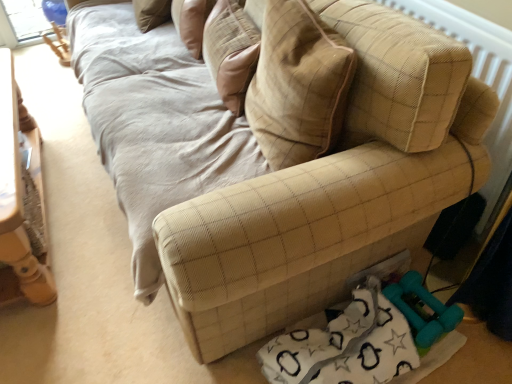
Question: From the image's perspective, relative to teal rubber dumbbells at lower right, is beige textured pillow at upper center above or below?

Choices:
 (A) above
 (B) below

Answer: (A)

Question: From a real-world perspective, is beige textured pillow at upper center positioned above or below teal rubber dumbbells at lower right?

Choices:
 (A) below
 (B) above

Answer: (B)

Question: Which object is positioned closest to the beige quilted pillow at center?

Choices:
 (A) wooden table at left
 (B) teal rubber dumbbells at lower right
 (C) beige textured pillow at upper center
 (D) beige fabric radiator at upper right

Answer: (D)

Question: Which of these objects is positioned farthest from the beige quilted pillow at center?

Choices:
 (A) teal rubber dumbbells at lower right
 (B) beige fabric radiator at upper right
 (C) beige textured pillow at upper center
 (D) wooden table at left

Answer: (D)